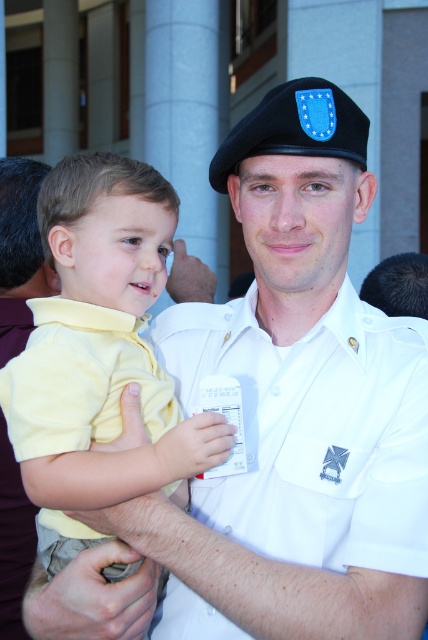
Question: Among these points, which one is farthest from the camera?

Choices:
 (A) (169, 224)
 (B) (317, 358)
 (C) (45, 317)

Answer: (B)

Question: Is yellow matte shirt at center closer to camera compared to yellow cotton shirt at center?

Choices:
 (A) yes
 (B) no

Answer: (B)

Question: Which object is positioned farthest from the yellow matte shirt at center?

Choices:
 (A) white cotton shirt at center
 (B) yellow cotton shirt at center

Answer: (A)

Question: Which of the following is the closest to the observer?

Choices:
 (A) (357, 564)
 (B) (17, 406)
 (C) (17, 444)

Answer: (C)

Question: In this image, where is yellow matte shirt at center located relative to yellow cotton shirt at center?

Choices:
 (A) left
 (B) right

Answer: (B)

Question: Is yellow matte shirt at center thinner than yellow cotton shirt at center?

Choices:
 (A) yes
 (B) no

Answer: (B)